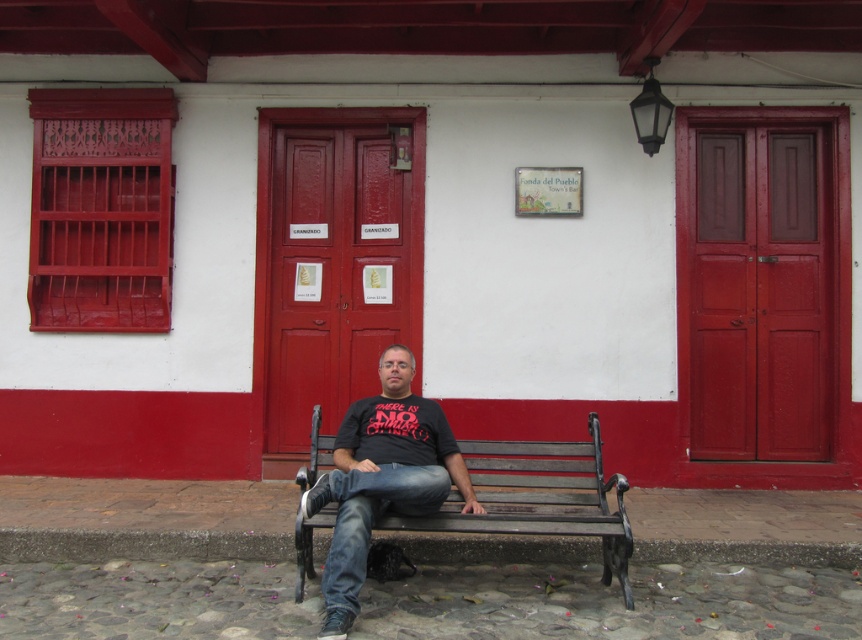
You are standing in front of the building and see the black matte shirt at center and the wooden bench at center. Which object is nearer to you?

The black matte shirt at center is closer to the viewer than the wooden bench at center.

You are a photographer trying to capture the man and the bench in a single shot. The camera has a minimum focus distance of 16 inches. Can you focus on both the black matte shirt at center and the wooden bench at center without moving the camera?

The black matte shirt at center is 15.96 inches from the wooden bench at center. Since the camera requires at least 16 inches to focus on two objects, you cannot focus on both the black matte shirt at center and the wooden bench at center without moving the camera.